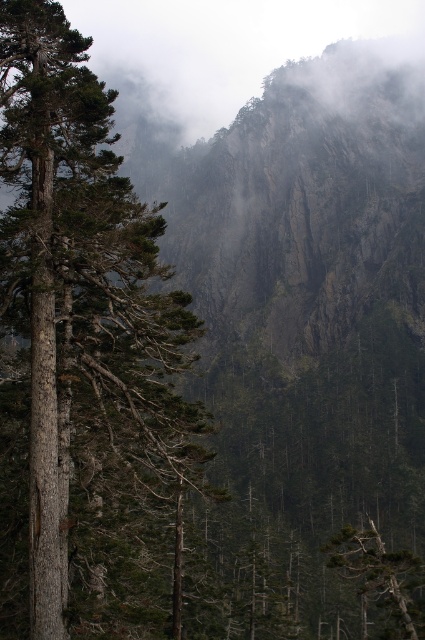
You are a hiker trying to cross a narrow path between two trees. The path is between the brown textured tree trunk at left and the green matte tree at lower right. If the path is 1.2 meters wide, can your 1.5 meter wide backpack fit through?

The path between the brown textured tree trunk at left and the green matte tree at lower right is 1.2 meters wide, which is narrower than your 1.5 meter wide backpack. Therefore, your backpack cannot fit through the path.

You are a hiker trying to navigate through the misty mountain forest. You see the brown textured tree trunk at left and the green matte tree at lower right. Which tree should you head towards if you want to move towards the right side of the forest?

You should head towards the green matte tree at lower right because it is located on the right side of the brown textured tree trunk at left.

Consider the image. You are standing at the base of the mountain and want to take a photo of the point at coordinates point (84, 394). If your camera has a maximum focus range of 25 meters, will it be able to focus on the point?

The distance of point (84, 394) from camera is 24.88 meters, which is within the camera maximum focus range of 25 meters. So the camera can focus on the point.